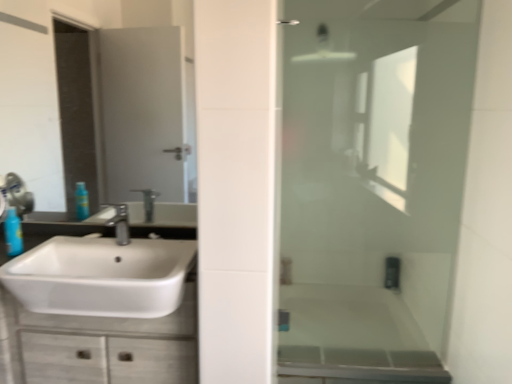
Question: Should I look upward or downward to see clear glass mirror at upper left?

Choices:
 (A) down
 (B) up

Answer: (B)

Question: Does white glossy cabinet at lower left have a lesser height compared to transparent glass shower door at right?

Choices:
 (A) yes
 (B) no

Answer: (A)

Question: Is white glossy cabinet at lower left bigger than transparent glass shower door at right?

Choices:
 (A) no
 (B) yes

Answer: (B)

Question: Considering the relative sizes of white glossy cabinet at lower left and transparent glass shower door at right in the image provided, is white glossy cabinet at lower left smaller than transparent glass shower door at right?

Choices:
 (A) yes
 (B) no

Answer: (B)

Question: Considering the relative positions of white glossy cabinet at lower left and transparent glass shower door at right in the image provided, is white glossy cabinet at lower left to the right of transparent glass shower door at right from the viewer's perspective?

Choices:
 (A) yes
 (B) no

Answer: (B)

Question: Can we say white glossy cabinet at lower left lies outside transparent glass shower door at right?

Choices:
 (A) yes
 (B) no

Answer: (A)

Question: Is white glossy cabinet at lower left oriented away from transparent glass shower door at right?

Choices:
 (A) yes
 (B) no

Answer: (B)

Question: Is the position of transparent glass shower door at right more distant than that of translucent plastic bottle at left?

Choices:
 (A) yes
 (B) no

Answer: (A)

Question: Does transparent glass shower door at right have a greater width compared to translucent plastic bottle at left?

Choices:
 (A) yes
 (B) no

Answer: (B)

Question: Does transparent glass shower door at right come in front of translucent plastic bottle at left?

Choices:
 (A) yes
 (B) no

Answer: (B)

Question: Does transparent glass shower door at right have a greater height compared to translucent plastic bottle at left?

Choices:
 (A) yes
 (B) no

Answer: (A)

Question: Considering the relative positions of transparent glass shower door at right and translucent plastic bottle at left in the image provided, is transparent glass shower door at right to the right of translucent plastic bottle at left from the viewer's perspective?

Choices:
 (A) no
 (B) yes

Answer: (B)

Question: From a real-world perspective, is transparent glass shower door at right over translucent plastic bottle at left?

Choices:
 (A) yes
 (B) no

Answer: (A)

Question: Does white glossy sink at left have a larger size compared to satin nickel faucet at center?

Choices:
 (A) no
 (B) yes

Answer: (B)